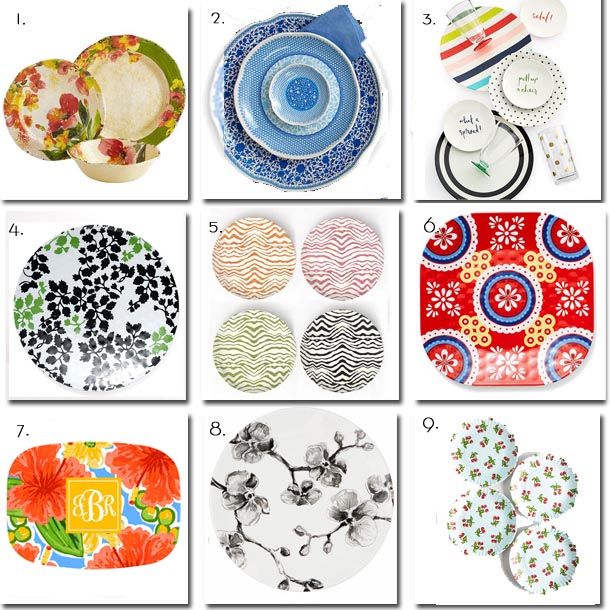
This screenshot has width=610, height=610. In order to click on red plate with white flowers, red circles around them, a light blue boarder around them, then a dark blue border and white doily, 5 in total in this screenshot , I will do `click(507, 293)`.